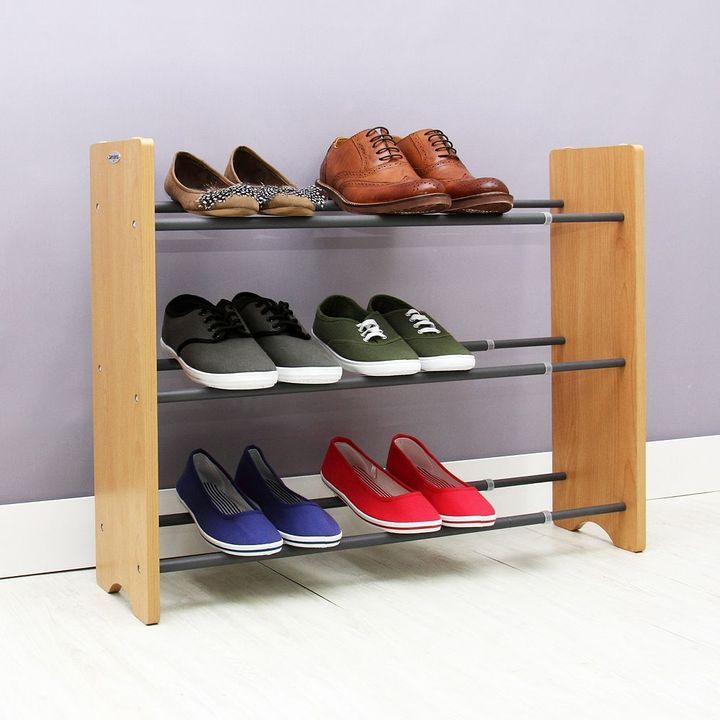
Identify the location of shoes on bottom rack. (230, 541), (283, 518), (430, 508), (454, 502).